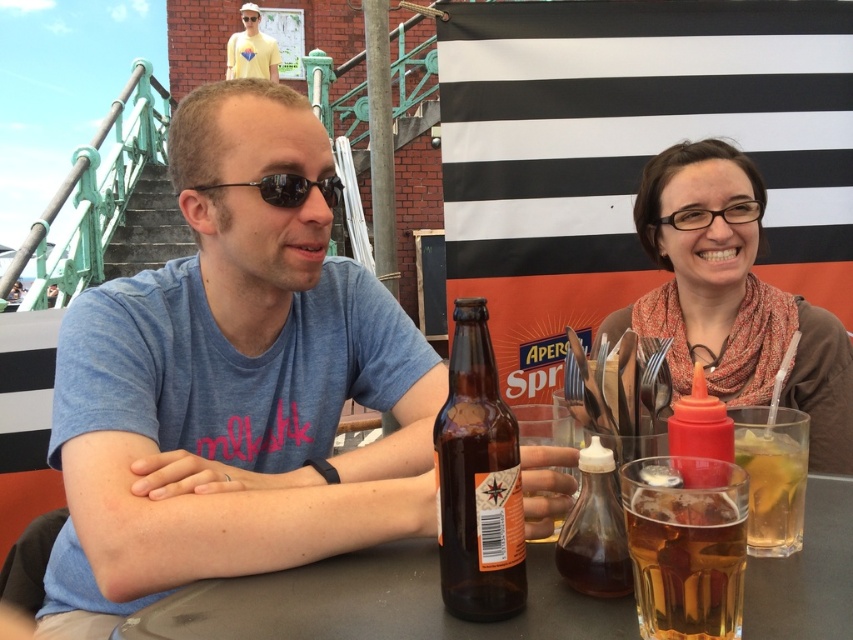
Does smooth gray table at center have a greater width compared to yellow matte shirt at upper left?

Correct, the width of smooth gray table at center exceeds that of yellow matte shirt at upper left.

Between smooth gray table at center and yellow matte shirt at upper left, which one is positioned higher?

yellow matte shirt at upper left

The height and width of the screenshot is (640, 853). What do you see at coordinates (373, 604) in the screenshot?
I see `smooth gray table at center` at bounding box center [373, 604].

I want to click on smooth gray table at center, so click(x=373, y=604).

This screenshot has height=640, width=853. What do you see at coordinates (231, 385) in the screenshot? I see `matte blue t-shirt at center` at bounding box center [231, 385].

Does matte blue t-shirt at center come behind smooth gray table at center?

Yes, matte blue t-shirt at center is further from the viewer.

Which is behind, point (196, 577) or point (531, 593)?

The point (196, 577) is behind.

The width and height of the screenshot is (853, 640). What are the coordinates of `matte blue t-shirt at center` in the screenshot? It's located at (231, 385).

Which of these two, matte blue t-shirt at center or matte brown scarf at upper right, stands taller?

matte brown scarf at upper right

Is matte blue t-shirt at center to the right of matte brown scarf at upper right from the viewer's perspective?

No, matte blue t-shirt at center is not to the right of matte brown scarf at upper right.

The image size is (853, 640). Describe the element at coordinates (231, 385) in the screenshot. I see `matte blue t-shirt at center` at that location.

This screenshot has height=640, width=853. In order to click on matte blue t-shirt at center in this screenshot , I will do click(x=231, y=385).